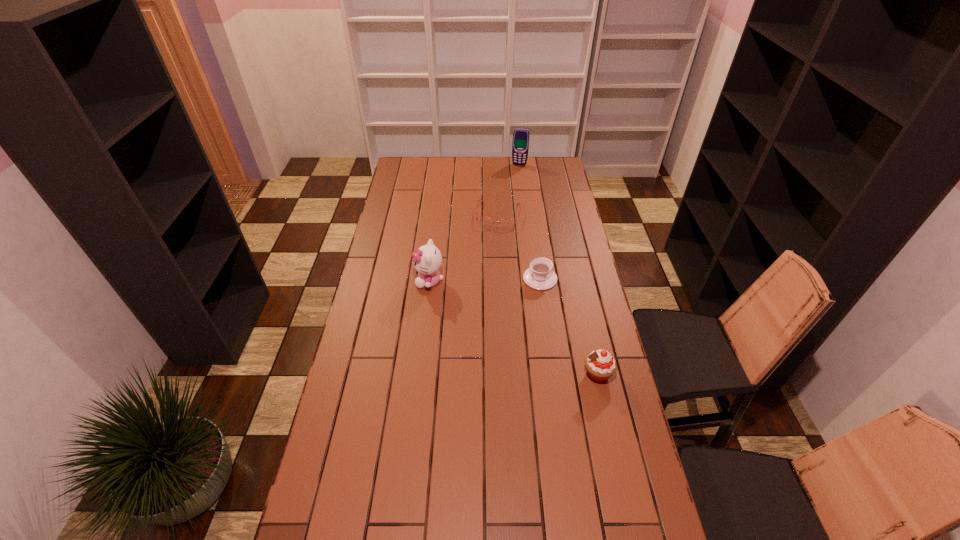
Find the location of `vacant space located on the front-facing side of the cellular telephone`. vacant space located on the front-facing side of the cellular telephone is located at coordinates (516, 173).

Find the location of a particular element. object at the far edge is located at coordinates (520, 145).

This screenshot has height=540, width=960. Identify the location of cupcake present at the right edge. (600, 365).

At what (x,y) coordinates should I click in order to perform the action: click on teacup present at the right edge. Please return your answer as a coordinate pair (x, y). The image size is (960, 540). Looking at the image, I should click on (540, 276).

The width and height of the screenshot is (960, 540). I want to click on free space at the far edge of the desktop, so click(436, 158).

This screenshot has width=960, height=540. Find the location of `blank space at the left edge of the desktop`. blank space at the left edge of the desktop is located at coordinates (396, 201).

In order to click on free space at the right edge of the desktop in this screenshot , I will do `click(595, 430)`.

This screenshot has width=960, height=540. In the image, there is a desktop. Find the location of `vacant space at the far left corner`. vacant space at the far left corner is located at coordinates (407, 164).

Locate an element on the screen. The height and width of the screenshot is (540, 960). free spot between the shortest object and the cellular telephone is located at coordinates (509, 190).

You are a GUI agent. You are given a task and a screenshot of the screen. Output one action in this format:
    pyautogui.click(x=<x>, y=<y>)
    Task: Click on the free spot between the cellular telephone and the fourth tallest object
    
    Given the screenshot: What is the action you would take?
    pyautogui.click(x=530, y=221)